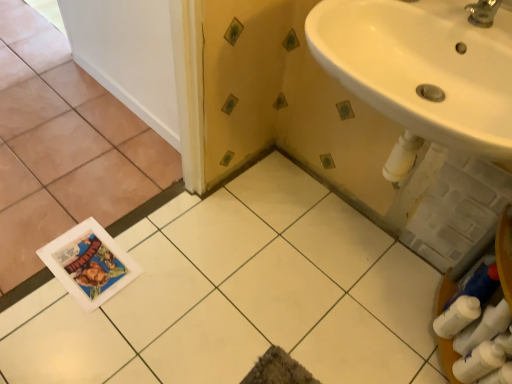
You are a GUI agent. You are given a task and a screenshot of the screen. Output one action in this format:
    pyautogui.click(x=<x>, y=<y>)
    Task: Click on the empty space that is ontop of white glossy tile at center, marked as the 1th ceramic tile in a right-to-left arrangement (from a real-world perspective)
    
    Given the screenshot: What is the action you would take?
    pyautogui.click(x=255, y=292)